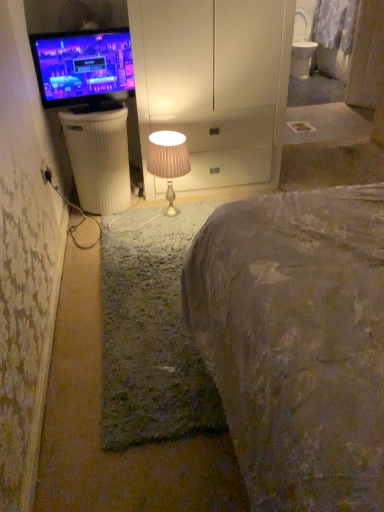
Question: Is point (51, 176) closer or farther from the camera than point (49, 77)?

Choices:
 (A) farther
 (B) closer

Answer: (B)

Question: Would you say black plastic electric outlet at lower left is to the left or to the right of matte black tv at left in the picture?

Choices:
 (A) right
 (B) left

Answer: (B)

Question: Which of these objects is positioned farthest from the black plastic electric outlet at lower left?

Choices:
 (A) matte black tv at left
 (B) matte beige lampshade at center
 (C) white ribbed plastic trash bin/can at left

Answer: (B)

Question: Which is nearer to the black plastic electric outlet at lower left?

Choices:
 (A) white ribbed plastic trash bin/can at left
 (B) matte black tv at left
 (C) matte beige lampshade at center

Answer: (A)